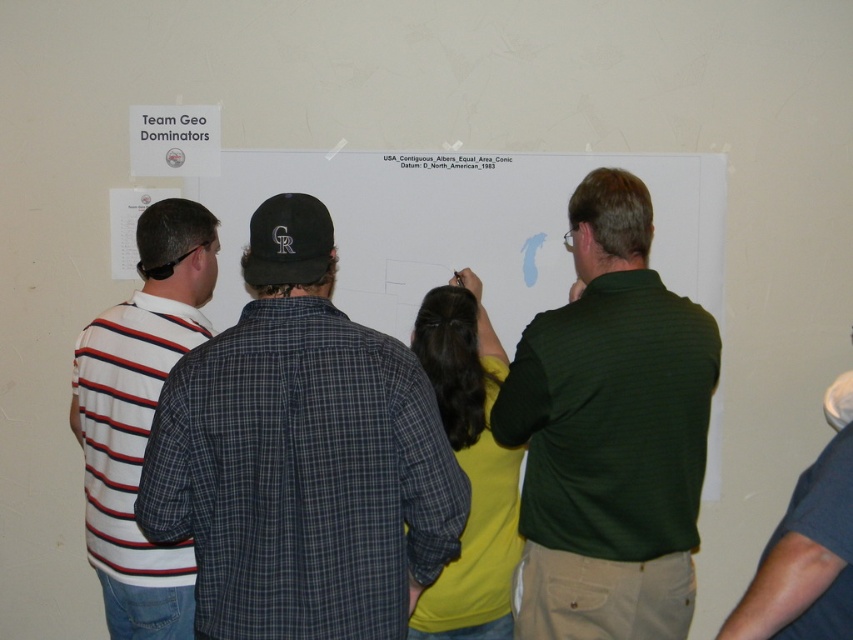
In the scene shown: You are standing at the origin point in the room. The whiteboard is located at coordinates 0,0. The striped cotton shirt at left is represented by point (300,456). Can you determine the direction of the striped cotton shirt at left relative to the whiteboard?

The striped cotton shirt at left is located at coordinates (300,456) relative to the whiteboard at 0,0. This means it is positioned to the northeast of the whiteboard.

You are standing at the origin point of the coordinate system in the room where the whiteboard is located. The whiteboard is placed at the far wall. If you want to walk to the white striped shirt at left, which direction should you move relative to the whiteboard?

Since the white striped shirt at left is at coordinate point (x=140, y=417), you should move towards the right side of the whiteboard to reach it.